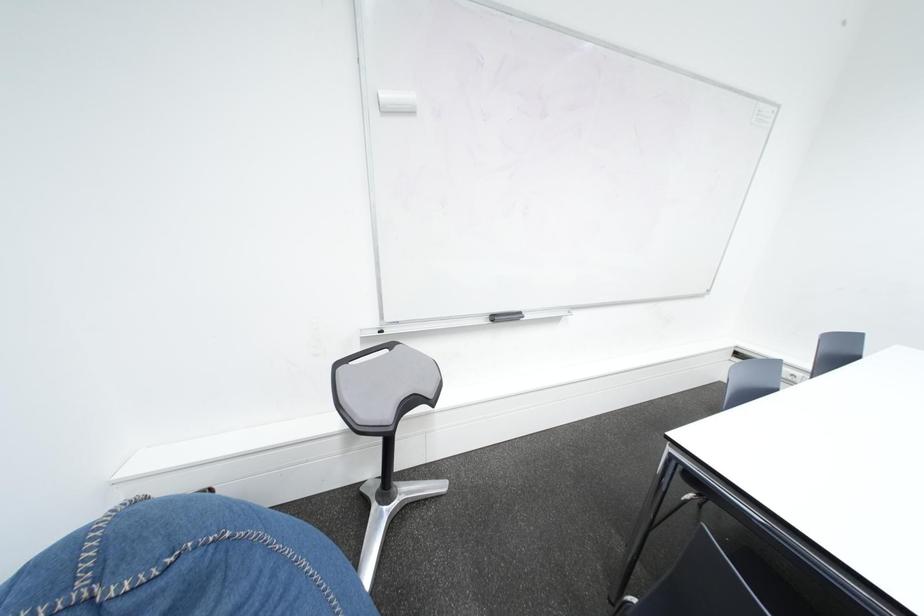
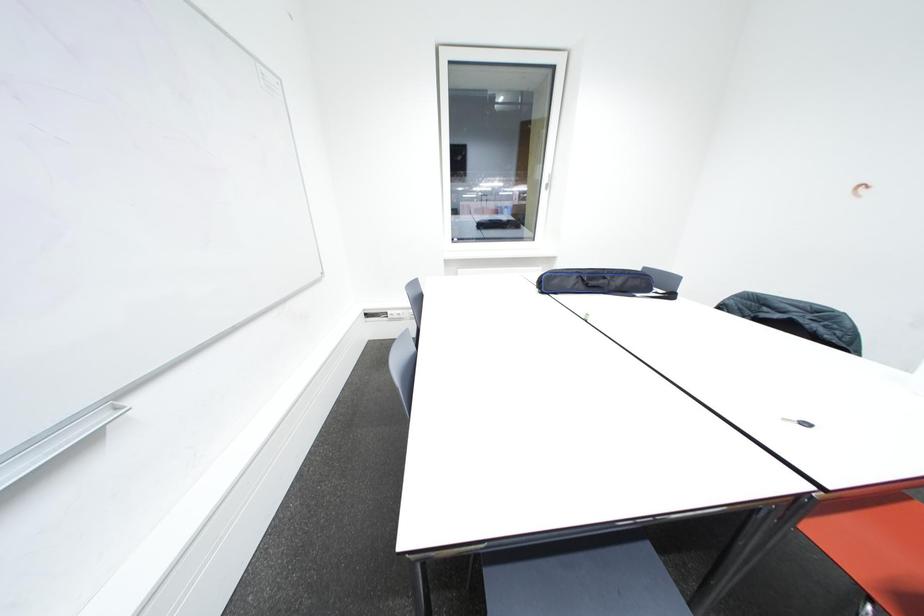
Based on the continuous images, in which direction is the camera rotating?

The camera's rotation is toward right-down.